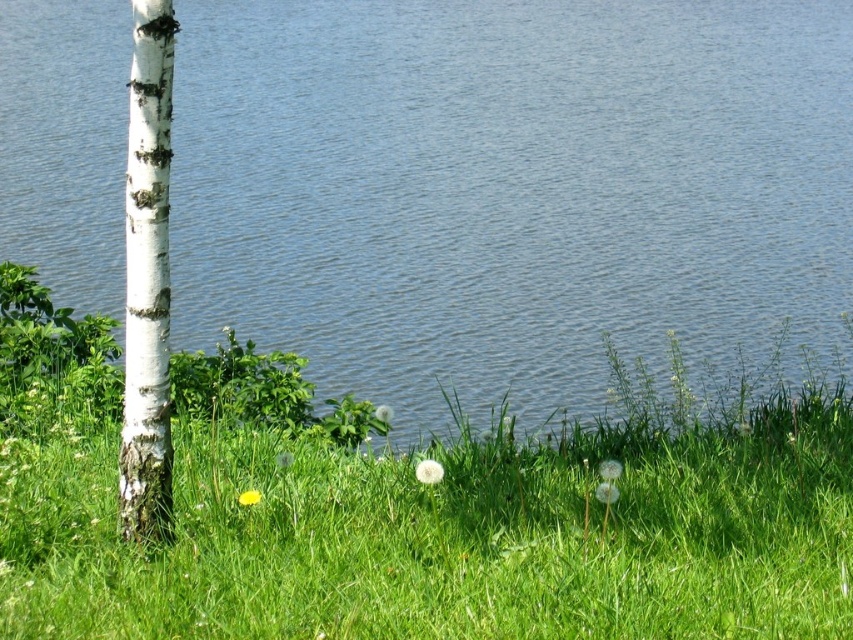
Who is lower down, blue water at center or white bark tree at left?

white bark tree at left is lower down.

Measure the distance from blue water at center to white bark tree at left.

They are 13.14 meters apart.

Is point (12, 198) positioned in front of point (157, 100)?

No.

Where is `blue water at center`? The height and width of the screenshot is (640, 853). blue water at center is located at coordinates (509, 189).